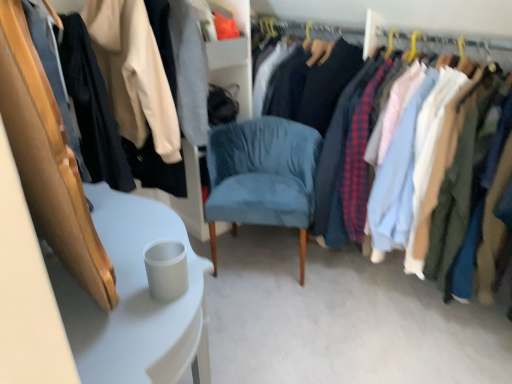
Question: From a real-world perspective, is white glossy table at lower left over suede blue chair at center?

Choices:
 (A) yes
 (B) no

Answer: (A)

Question: Is white glossy table at lower left to the left of suede blue chair at center from the viewer's perspective?

Choices:
 (A) yes
 (B) no

Answer: (A)

Question: Is white glossy table at lower left touching suede blue chair at center?

Choices:
 (A) yes
 (B) no

Answer: (B)

Question: Is white glossy table at lower left positioned behind suede blue chair at center?

Choices:
 (A) no
 (B) yes

Answer: (A)

Question: From the image's perspective, does white glossy table at lower left appear lower than suede blue chair at center?

Choices:
 (A) no
 (B) yes

Answer: (B)

Question: Considering the positions of suede blue chair at center and matte fabric shirts at right, the 1th closet viewed from the right, in the image, is suede blue chair at center wider or thinner than matte fabric shirts at right, the 1th closet viewed from the right,?

Choices:
 (A) thin
 (B) wide

Answer: (A)

Question: Considering the positions of suede blue chair at center and matte fabric shirts at right, the 2th closet when ordered from left to right, in the image, is suede blue chair at center taller or shorter than matte fabric shirts at right, the 2th closet when ordered from left to right,?

Choices:
 (A) short
 (B) tall

Answer: (A)

Question: Considering the positions of point (280, 150) and point (509, 155), is point (280, 150) closer or farther from the camera than point (509, 155)?

Choices:
 (A) closer
 (B) farther

Answer: (B)

Question: Considering the relative positions of suede blue chair at center and matte fabric shirts at right, the 2th closet when ordered from left to right, in the image provided, is suede blue chair at center to the left or to the right of matte fabric shirts at right, the 2th closet when ordered from left to right,?

Choices:
 (A) left
 (B) right

Answer: (A)

Question: Considering their positions, is matte black jacket at upper left, positioned as the 1th closet in left-to-right order, located in front of or behind matte fabric shirts at right, the 1th closet viewed from the right?

Choices:
 (A) front
 (B) behind

Answer: (B)

Question: Considering the relative positions of matte black jacket at upper left, the second closet from the right, and matte fabric shirts at right, the 1th closet viewed from the right, in the image provided, is matte black jacket at upper left, the second closet from the right, to the left or to the right of matte fabric shirts at right, the 1th closet viewed from the right,?

Choices:
 (A) right
 (B) left

Answer: (B)

Question: From the image's perspective, is matte black jacket at upper left, the second closet from the right, above or below matte fabric shirts at right, the 1th closet viewed from the right?

Choices:
 (A) below
 (B) above

Answer: (B)

Question: From a real-world perspective, relative to matte fabric shirts at right, the 1th closet viewed from the right, is matte black jacket at upper left, positioned as the 1th closet in left-to-right order, vertically above or below?

Choices:
 (A) below
 (B) above

Answer: (B)

Question: From the image's perspective, is matte fabric shirts at right, the 2th closet when ordered from left to right, above or below suede blue chair at center?

Choices:
 (A) below
 (B) above

Answer: (B)

Question: In terms of height, does matte fabric shirts at right, the 2th closet when ordered from left to right, look taller or shorter compared to suede blue chair at center?

Choices:
 (A) short
 (B) tall

Answer: (B)